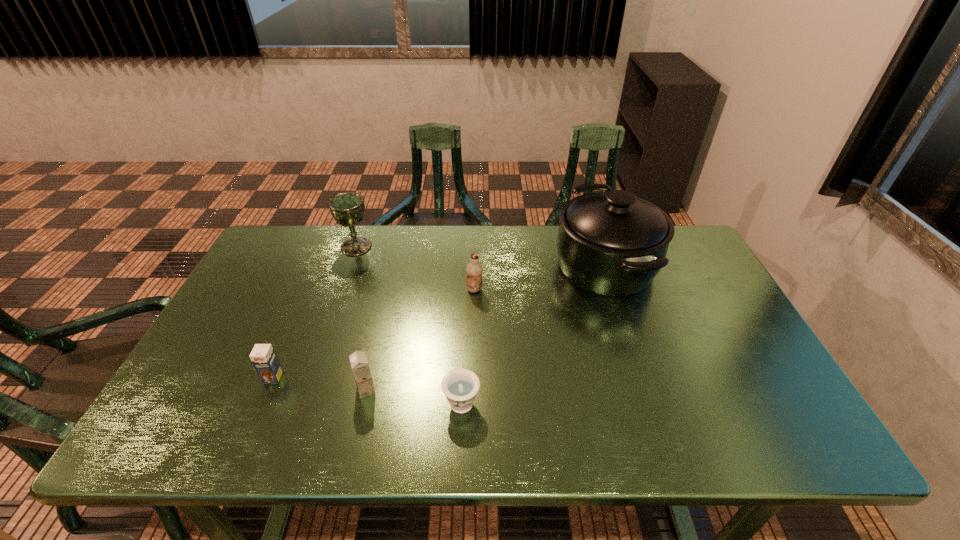
Identify the location of vacant space located on the left of the farthest chocolate milk. The image size is (960, 540). (422, 290).

I want to click on vacant space positioned on the back of the third object from left to right, so click(x=379, y=330).

You are a GUI agent. You are given a task and a screenshot of the screen. Output one action in this format:
    pyautogui.click(x=<x>, y=<y>)
    Task: Click on the vacant space located on the front label of the leftmost chocolate milk
    
    Given the screenshot: What is the action you would take?
    pyautogui.click(x=244, y=448)

Identify the location of vacant space located on the side of the teacup with the handle. (466, 296).

The image size is (960, 540). Identify the location of free location located on the side of the teacup with the handle. (464, 332).

I want to click on vacant space situated 0.220m on the side of the teacup with the handle, so click(x=465, y=313).

Locate an element on the screen. This screenshot has height=540, width=960. saucepan at the far edge is located at coordinates (613, 243).

The image size is (960, 540). I want to click on chalice present at the far edge, so click(347, 208).

You are a GUI agent. You are given a task and a screenshot of the screen. Output one action in this format:
    pyautogui.click(x=<x>, y=<y>)
    Task: Click on the object that is at the near edge
    The image size is (960, 540).
    Given the screenshot: What is the action you would take?
    pyautogui.click(x=460, y=386)

I want to click on object situated at the right edge, so click(613, 243).